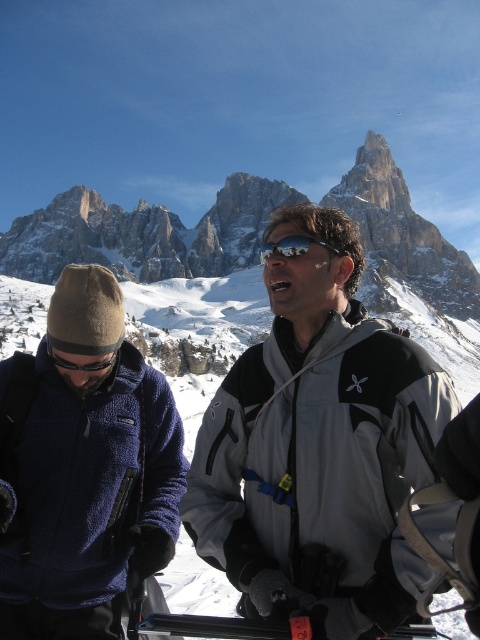
Question: Which point is farther to the camera?

Choices:
 (A) (97, 362)
 (B) (235, 477)
 (C) (54, 333)
 (D) (305, 240)

Answer: (D)

Question: Which point is closer to the camera?

Choices:
 (A) (268, 545)
 (B) (284, 241)

Answer: (A)

Question: Is shiny reflective sunglasses at center below black reflective goggles at left?

Choices:
 (A) yes
 (B) no

Answer: (B)

Question: Is blue fleece jacket at left bigger than shiny reflective sunglasses at center?

Choices:
 (A) yes
 (B) no

Answer: (B)

Question: Does gray/synthetic jacket at center appear on the left side of black reflective goggles at left?

Choices:
 (A) no
 (B) yes

Answer: (A)

Question: Which of these objects is positioned closest to the blue fleece jacket at left?

Choices:
 (A) shiny reflective sunglasses at center
 (B) gray/synthetic jacket at center

Answer: (B)